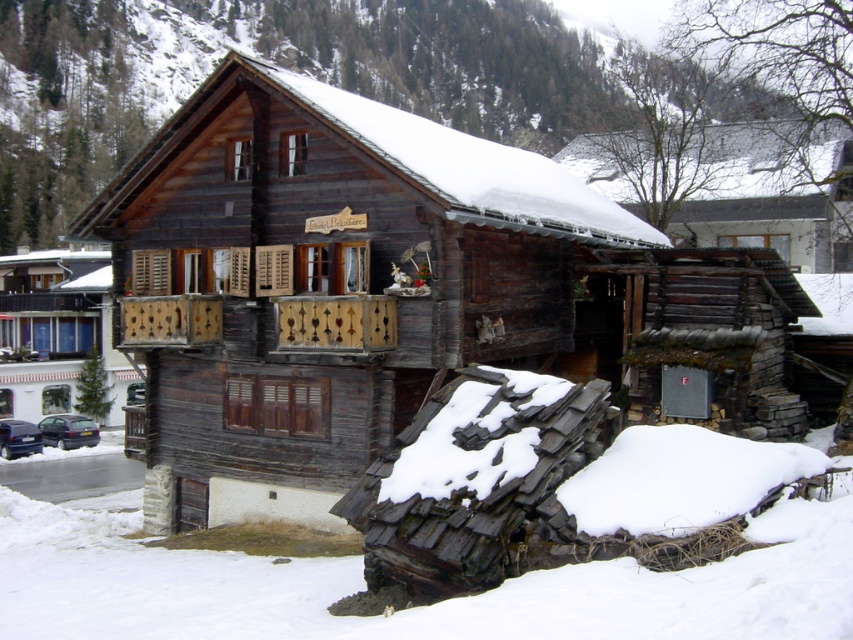
Does wooden cabin at center have a larger size compared to shiny black car at lower left?

Yes.

Which is in front, point (48, 256) or point (96, 435)?

Point (96, 435) is in front.

Find the location of a particular element. This screenshot has height=640, width=853. wooden cabin at center is located at coordinates (56, 332).

Image resolution: width=853 pixels, height=640 pixels. What are the coordinates of `wooden cabin at center` in the screenshot? It's located at (56, 332).

Does shiny black car at lower left appear on the left side of dark blue metallic car at lower left?

Incorrect, shiny black car at lower left is not on the left side of dark blue metallic car at lower left.

Who is more forward, (61, 413) or (24, 428)?

Point (24, 428) is in front.

This screenshot has height=640, width=853. In order to click on shiny black car at lower left in this screenshot , I will do `click(68, 429)`.

Which of these two, wooden cabin at center or dark blue metallic car at lower left, stands shorter?

Standing shorter between the two is dark blue metallic car at lower left.

Does wooden cabin at center lie in front of dark blue metallic car at lower left?

No, wooden cabin at center is behind dark blue metallic car at lower left.

Which is in front, point (41, 410) or point (10, 458)?

Point (10, 458) is in front.

Locate an element on the screen. This screenshot has width=853, height=640. wooden cabin at center is located at coordinates (56, 332).